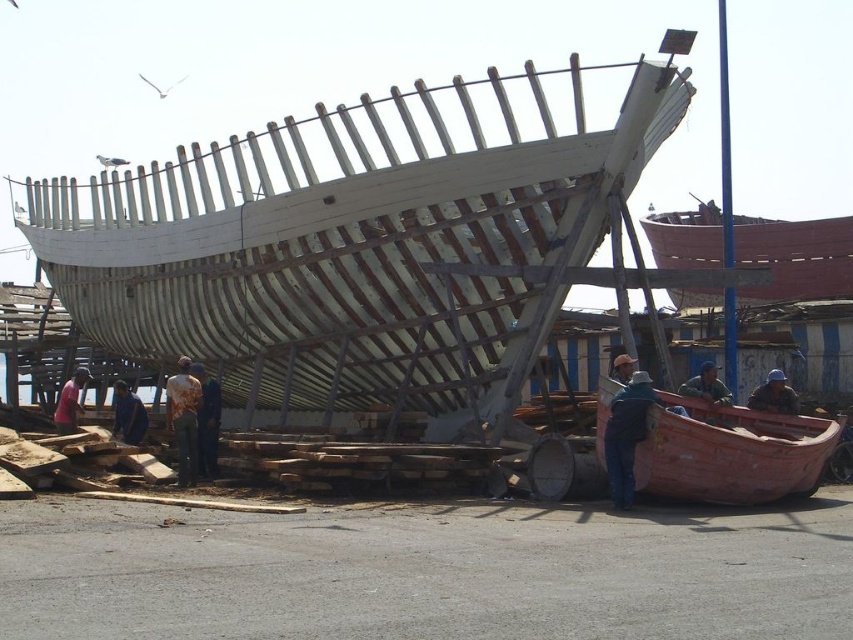
You are a worker in the shipyard and you want to place a tool on the ground near the denim jacket at center. However, you need to ensure it won t be under the brown leather hat at center. Where should you place the tool?

The denim jacket at center is below the brown leather hat at center, so placing the tool near the denim jacket at center but away from the area directly under the brown leather hat at center would ensure it is not under the hat.

You are standing at the point with coordinates point (x=721, y=400) and want to walk to the point with coordinates point (x=804, y=228). Is there a clear path between these two points without any obstacles?

Point (x=804, y=228) is behind point (x=721, y=400), so there might be an obstacle blocking the path between them. You may need to move around point (x=721, y=400) to reach point (x=804, y=228).

You are a worker in the shipyard and you need to locate your denim jacket at center. Where should you look?

The denim jacket at center is located at point [625,435].